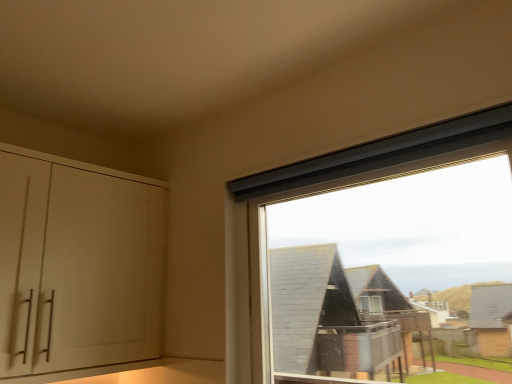
Question: From the image's perspective, is white matte cabinet at left located above or below transparent glass window at upper right?

Choices:
 (A) above
 (B) below

Answer: (B)

Question: Considering the positions of point (128, 261) and point (230, 372), is point (128, 261) closer or farther from the camera than point (230, 372)?

Choices:
 (A) closer
 (B) farther

Answer: (B)

Question: Visually, is white matte cabinet at left positioned to the left or to the right of transparent glass window at upper right?

Choices:
 (A) right
 (B) left

Answer: (B)

Question: Considering the positions of transparent glass window at upper right and white matte cabinet at left in the image, is transparent glass window at upper right bigger or smaller than white matte cabinet at left?

Choices:
 (A) big
 (B) small

Answer: (B)

Question: Is point (370, 150) positioned closer to the camera than point (84, 228)?

Choices:
 (A) farther
 (B) closer

Answer: (B)

Question: Is transparent glass window at upper right inside the boundaries of white matte cabinet at left, or outside?

Choices:
 (A) inside
 (B) outside

Answer: (B)

Question: From the image's perspective, is transparent glass window at upper right positioned above or below white matte cabinet at left?

Choices:
 (A) above
 (B) below

Answer: (A)